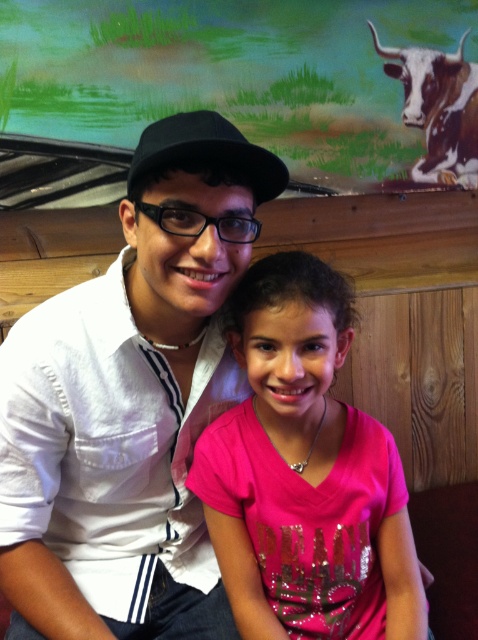
You are a photographer trying to capture a candid shot of the two people in the scene. You need to ensure that both the pink shiny shirt at center and the black matte baseball hat at upper center are in focus. Given that your camera has a depth of field that can cover 15 inches, will both objects be in focus?

The distance between the pink shiny shirt at center and the black matte baseball hat at upper center is 14.71 inches, which is within the camera depth of field of 15 inches. Therefore, both objects will be in focus.

You are a photographer setting up a shoot in this scene. You need to position a light to the right of both the white matte shirt at center and the pink shiny shirt at center. Is this possible given their arrangement?

The white matte shirt at center is to the left of the pink shiny shirt at center. Therefore, placing a light to the right of both shirts would be possible as the pink shiny shirt at center is on the right side, so positioning the light further to the right of it would satisfy both conditions.